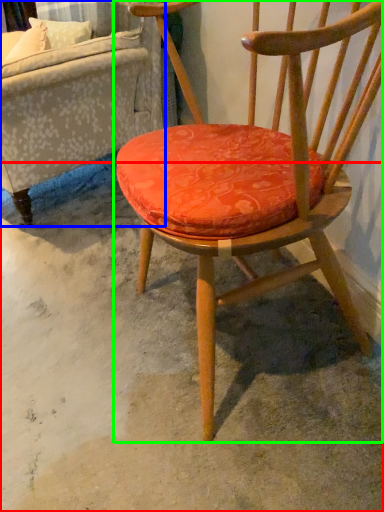
Question: Which is farther away from concrete (highlighted by a red box)? studio couch (highlighted by a blue box) or chair (highlighted by a green box)?

Choices:
 (A) studio couch
 (B) chair

Answer: (A)